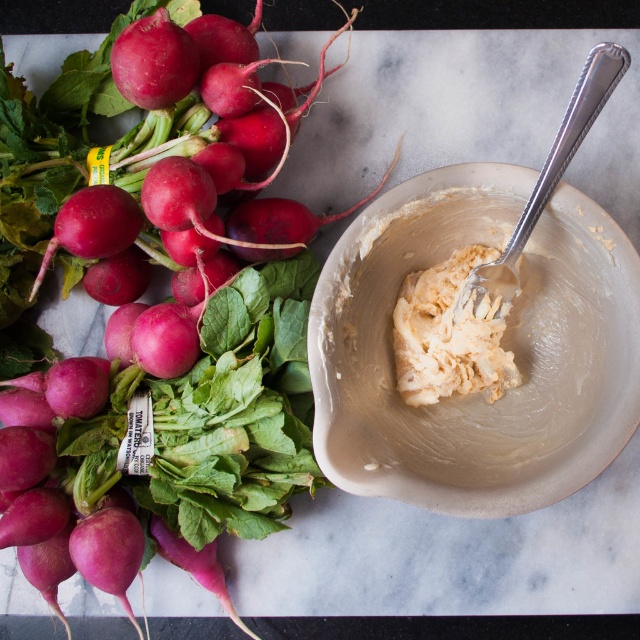
Between white creamy paste at center and silver textured spoon at upper right, which one has more height?

silver textured spoon at upper right

Does white creamy paste at center appear on the left side of silver textured spoon at upper right?

Yes, white creamy paste at center is to the left of silver textured spoon at upper right.

Which is in front, point (481, 340) or point (557, 134)?

Positioned in front is point (557, 134).

You are a GUI agent. You are given a task and a screenshot of the screen. Output one action in this format:
    pyautogui.click(x=<x>, y=<y>)
    Task: Click on the white creamy paste at center
    
    Given the screenshot: What is the action you would take?
    pyautogui.click(x=449, y=333)

Is smooth red radish at left thinner than white creamy paste at center?

No.

The width and height of the screenshot is (640, 640). In order to click on smooth red radish at left in this screenshot , I will do `click(148, 221)`.

Does smooth red radish at left appear on the right side of silver textured spoon at upper right?

Incorrect, smooth red radish at left is not on the right side of silver textured spoon at upper right.

Is point (180, 72) positioned after point (525, 205)?

That is True.

Identify the location of smooth red radish at left. (148, 221).

What are the coordinates of `smooth red radish at left` in the screenshot? It's located at (148, 221).